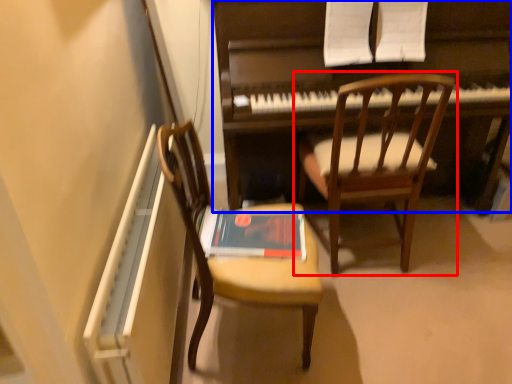
Question: Which object is further to the camera taking this photo, chair (highlighted by a red box) or piano (highlighted by a blue box)?

Choices:
 (A) chair
 (B) piano

Answer: (B)